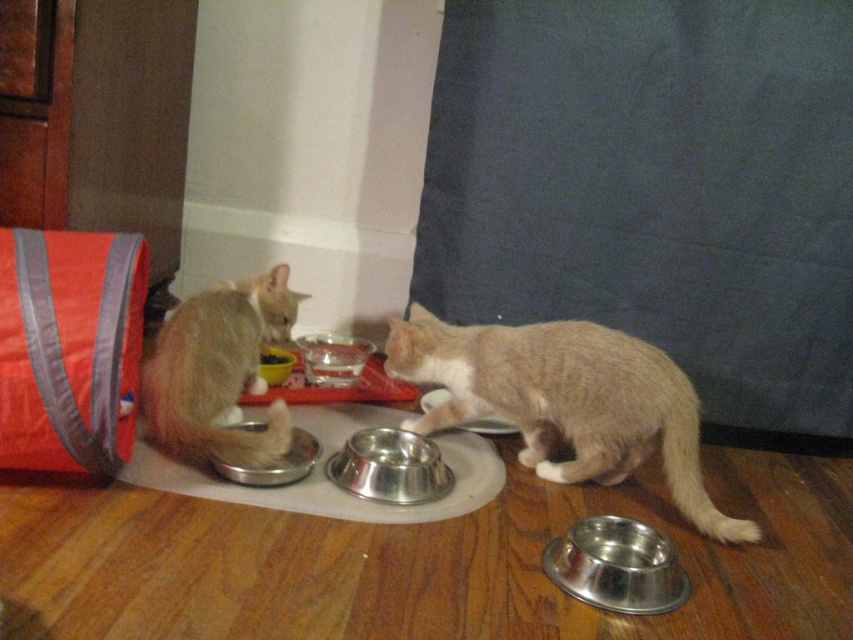
Question: Can you confirm if light brown fur at left is thinner than clear glass water at center?

Choices:
 (A) no
 (B) yes

Answer: (A)

Question: Based on their relative distances, which object is farther from the clear glass water at center?

Choices:
 (A) shiny metallic bowl at center
 (B) light brown fur at center

Answer: (B)

Question: Observing the image, what is the correct spatial positioning of shiny metallic bowl at lower right in reference to metallic silver bowl at center?

Choices:
 (A) left
 (B) right

Answer: (B)

Question: Does brushed metal bowl at center appear on the left side of metallic silver bowl at center?

Choices:
 (A) no
 (B) yes

Answer: (A)

Question: Which of the following is the closest to the observer?

Choices:
 (A) (503, 420)
 (B) (306, 374)

Answer: (A)

Question: Among these points, which one is farthest from the camera?

Choices:
 (A) (329, 342)
 (B) (556, 548)
 (C) (281, 461)
 (D) (686, 516)

Answer: (A)